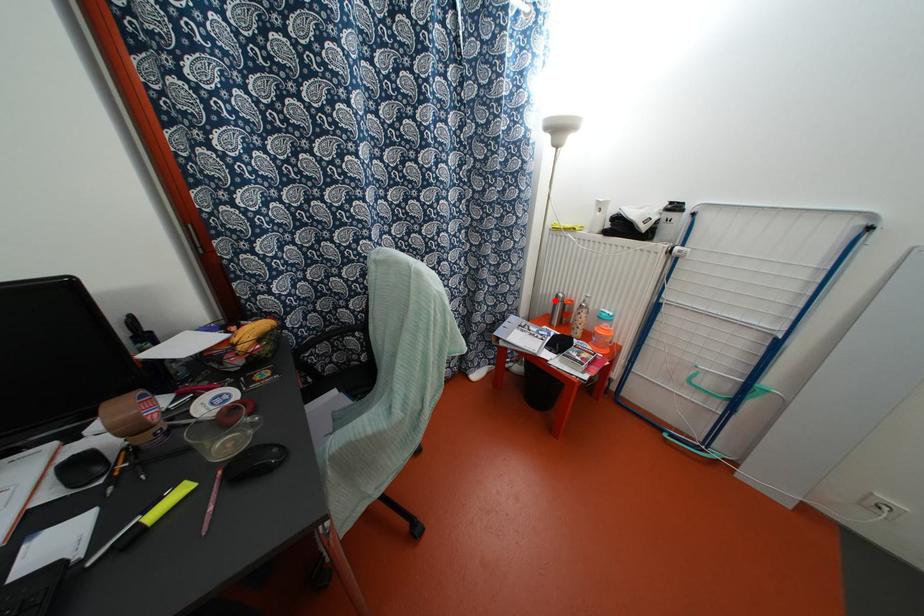
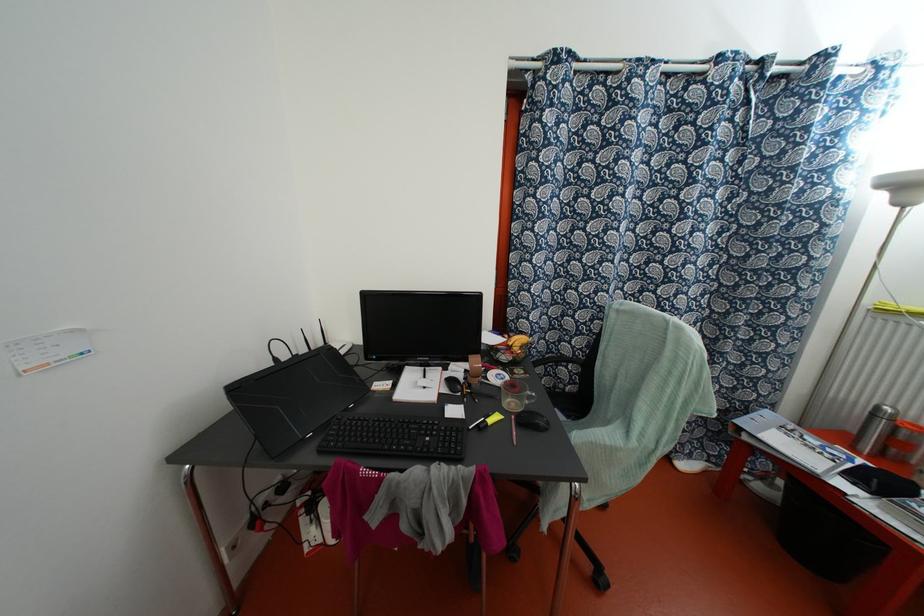
Where in the second image is the point corresponding to the highlighted location from the first image?

(872, 415)